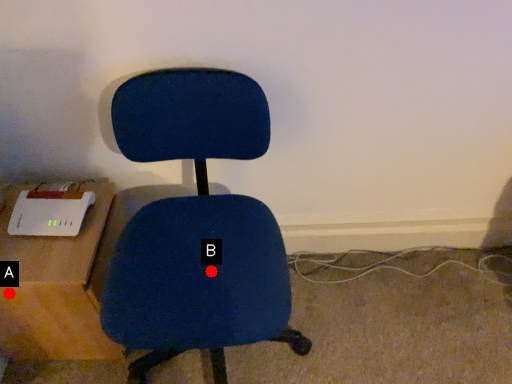
Question: Two points are circled on the image, labeled by A and B beside each circle. Which of the following is the closest to the observer?

Choices:
 (A) A is closer
 (B) B is closer

Answer: (B)